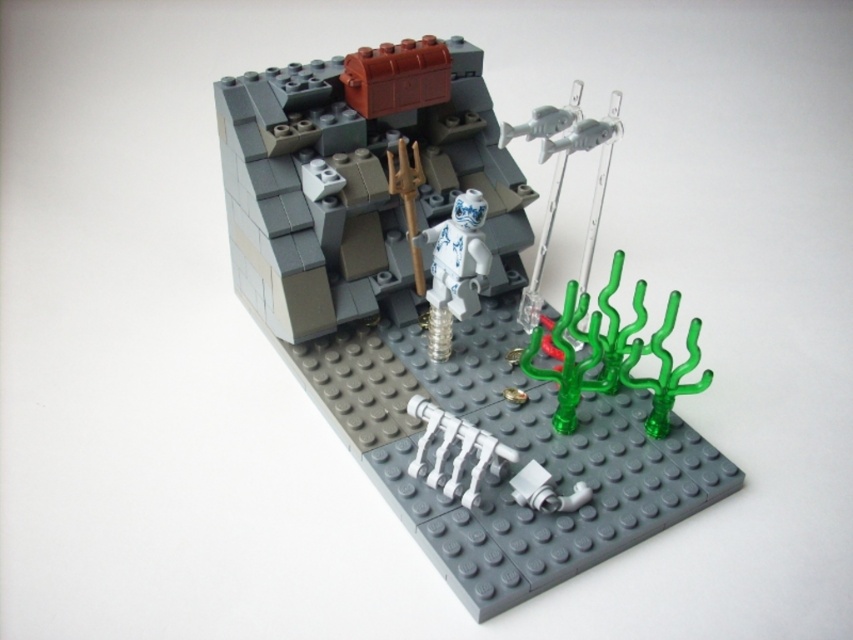
You are standing in front of the LEGO diorama and want to take a photo of the white glossy minifigure at center. If your camera can focus on objects up to 4 feet away, will it be able to capture a clear image of the minifigure?

The white glossy minifigure at center is 3.53 feet away from the camera, which is within the 4 feet focusing range. Therefore, the camera should be able to capture a clear image of the minifigure.

You are navigating a LEGO diorama and need to locate the white glossy minifigure at center. According to the scene description, where exactly is the white glossy minifigure positioned relative to the other elements?

The white glossy minifigure at center is located at point coordinates of approximately 0.492 on the x and 0.499 on the y axis, placing it nearly at the center of the scene.